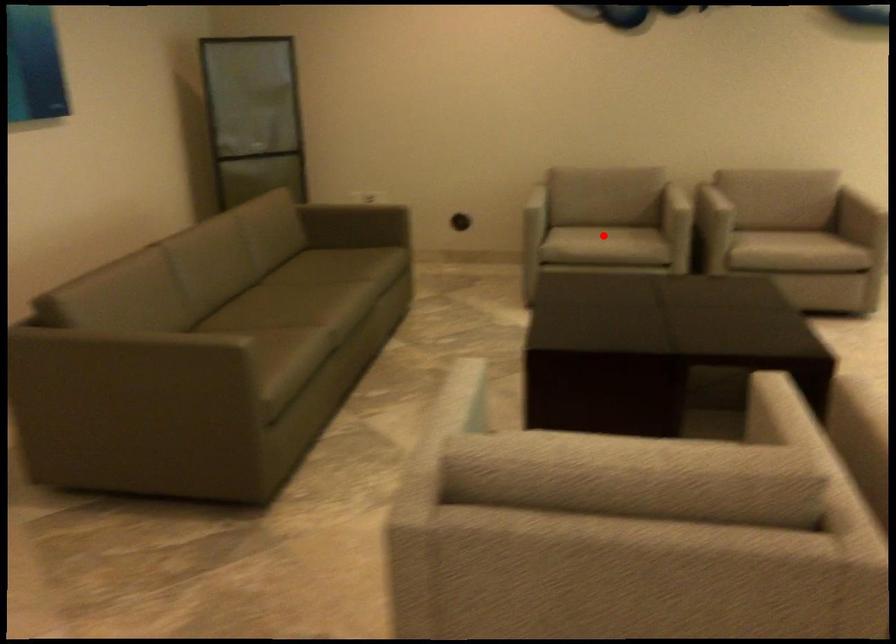
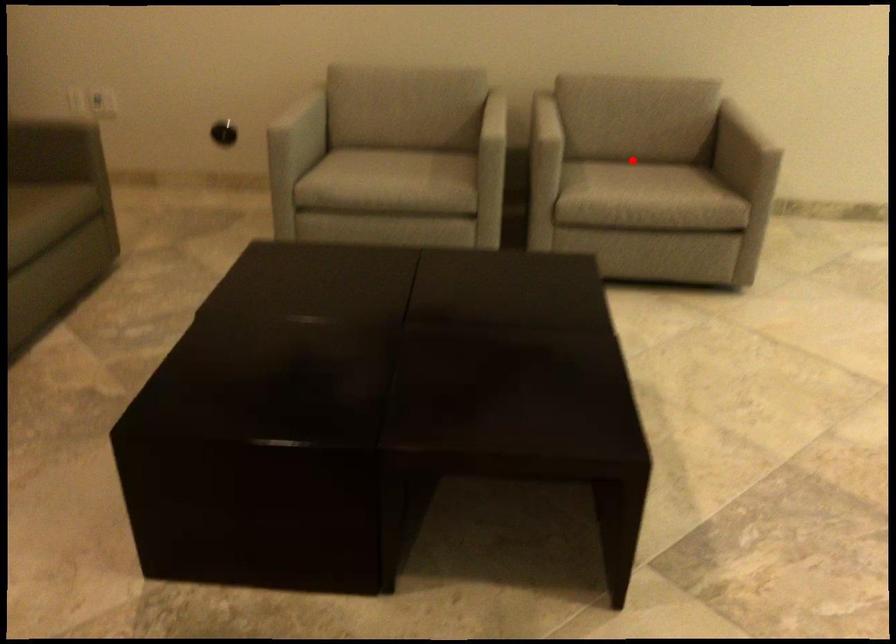
I am providing you with two images of the same scene from different viewpoints. A red point is marked on the first image and another point is marked on the second image. Are the points marked in image1 and image2 representing the same 3D position?

No